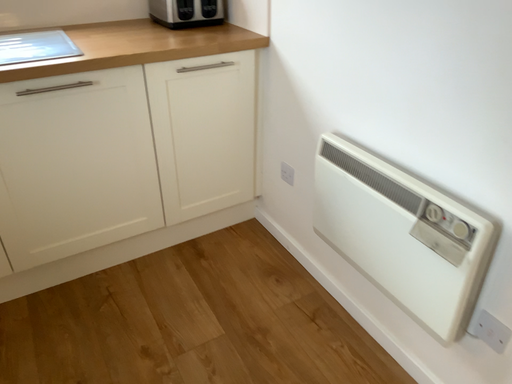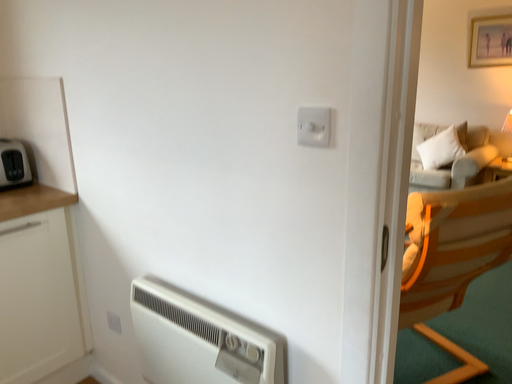
Question: How did the camera likely rotate when shooting the video?

Choices:
 (A) rotated right
 (B) rotated left

Answer: (A)